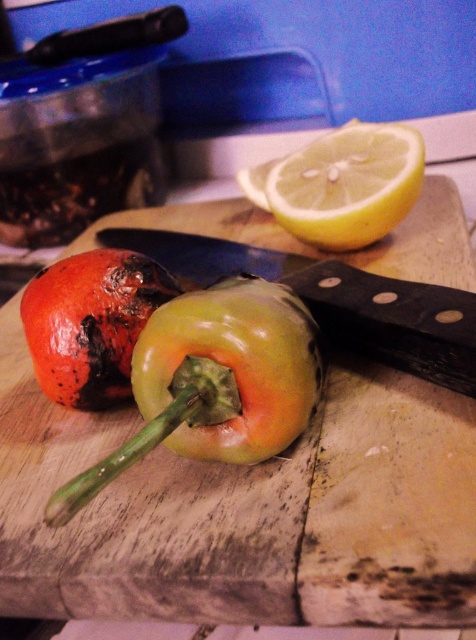
Question: Which object appears closest to the camera in this image?

Choices:
 (A) green matte bell pepper at center
 (B) yellow matte lemon at upper center

Answer: (A)

Question: Considering the real-world distances, which object is farthest from the yellow matte lemon at upper center?

Choices:
 (A) black plastic knife at center
 (B) wooden cutting board at center

Answer: (B)

Question: Which point is closer to the camera?

Choices:
 (A) black plastic knife at center
 (B) yellow matte lemon at upper center

Answer: (A)

Question: Is wooden cutting board at center further to camera compared to black plastic knife at center?

Choices:
 (A) no
 (B) yes

Answer: (A)

Question: Does green matte bell pepper at center appear over black plastic knife at center?

Choices:
 (A) no
 (B) yes

Answer: (A)

Question: Is black plastic knife at center positioned behind yellow matte lemon at upper center?

Choices:
 (A) yes
 (B) no

Answer: (B)